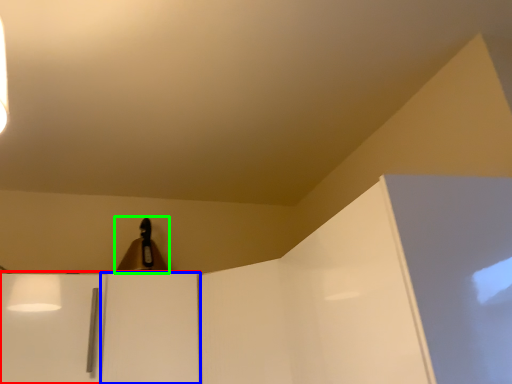
Question: Estimate the real-world distances between objects in this image. Which object is closer to cabinetry (highlighted by a red box), door (highlighted by a blue box) or lamp (highlighted by a green box)?

Choices:
 (A) door
 (B) lamp

Answer: (A)